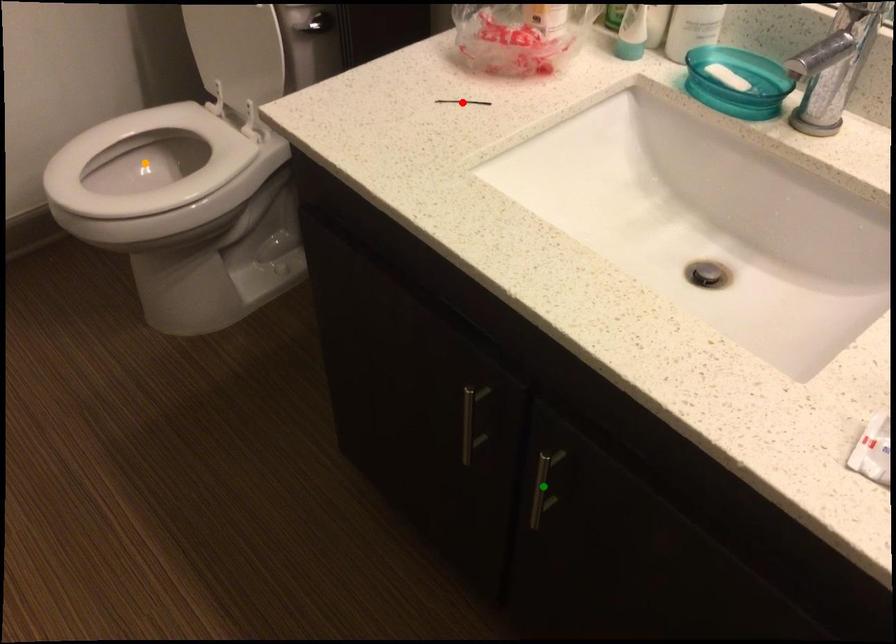
Order these from farthest to nearest:
- orange point
- green point
- red point

orange point
red point
green point